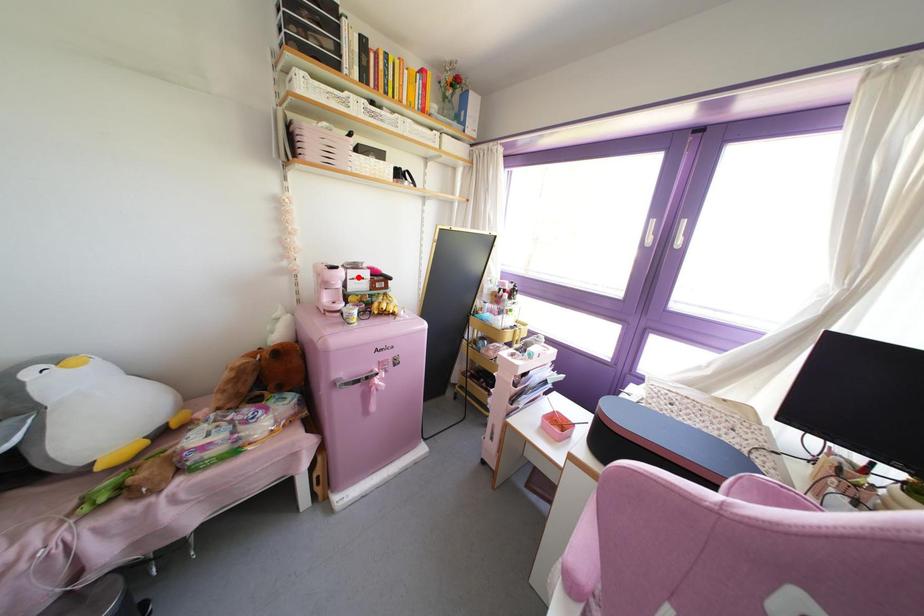
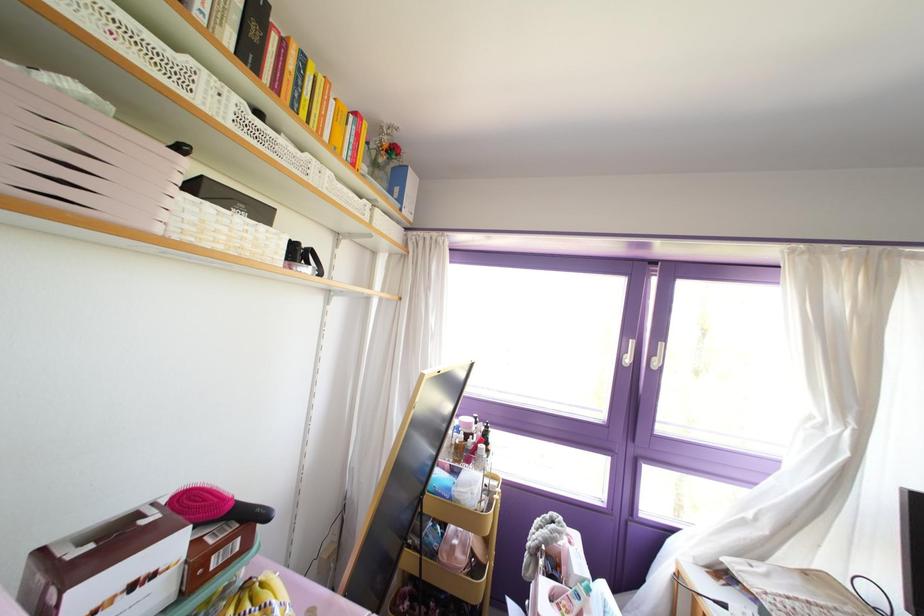
The point at the highlighted location is marked in the first image. Where is the corresponding point in the second image?

(132, 586)